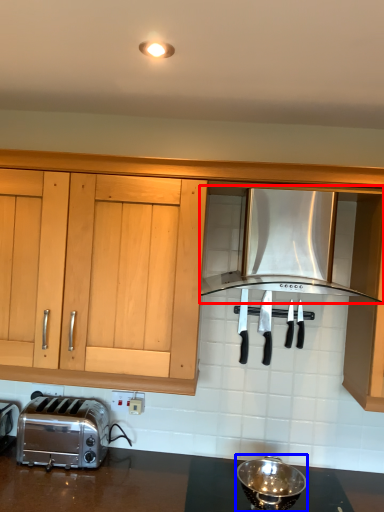
Question: Which point is closer to the camera, kitchen appliance (highlighted by a red box) or appliance (highlighted by a blue box)?

Choices:
 (A) kitchen appliance
 (B) appliance

Answer: (A)